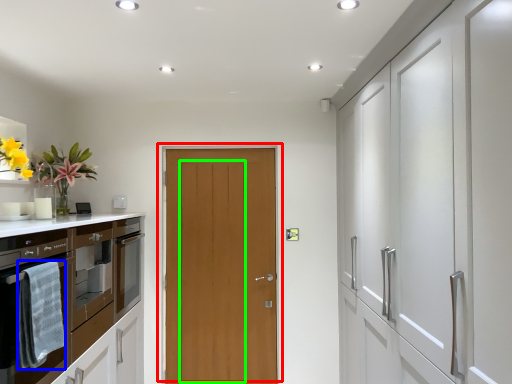
Question: Estimate the real-world distances between objects in this image. Which object is closer to door (highlighted by a red box), material (highlighted by a blue box) or door (highlighted by a green box)?

Choices:
 (A) material
 (B) door

Answer: (B)